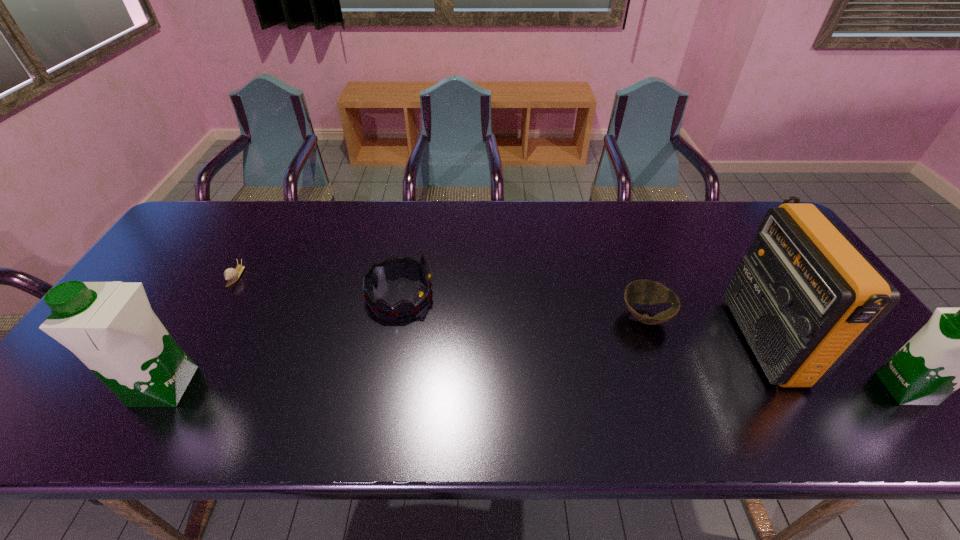
This screenshot has height=540, width=960. I want to click on free space between the taller soya milk and the radio receiver, so click(464, 363).

Identify the location of free space between the rightmost object and the left soya milk. (535, 388).

I want to click on free space between the radio receiver and the taller soya milk, so click(x=464, y=363).

You are a GUI agent. You are given a task and a screenshot of the screen. Output one action in this format:
    pyautogui.click(x=<x>, y=<y>)
    Task: Click on the blank region between the shortest object and the third object from right to left
    The width and height of the screenshot is (960, 540).
    Given the screenshot: What is the action you would take?
    (x=441, y=296)

The height and width of the screenshot is (540, 960). In order to click on free spot between the second object from right to left and the fourth tallest object in this screenshot , I will do `click(582, 317)`.

The width and height of the screenshot is (960, 540). Find the location of `free space between the left soya milk and the fourth tallest object`. free space between the left soya milk and the fourth tallest object is located at coordinates (282, 340).

Find the location of a particular element. The width and height of the screenshot is (960, 540). object that ranks as the fourth closest to the second object from right to left is located at coordinates (110, 326).

This screenshot has height=540, width=960. I want to click on object that is the fourth closest to the bowl, so click(110, 326).

Locate an element on the screen. The height and width of the screenshot is (540, 960). free space that satisfies the following two spatial constraints: 1. at the front of the fourth object from left to right with jewels; 2. on the right side of the tiara is located at coordinates pyautogui.click(x=396, y=316).